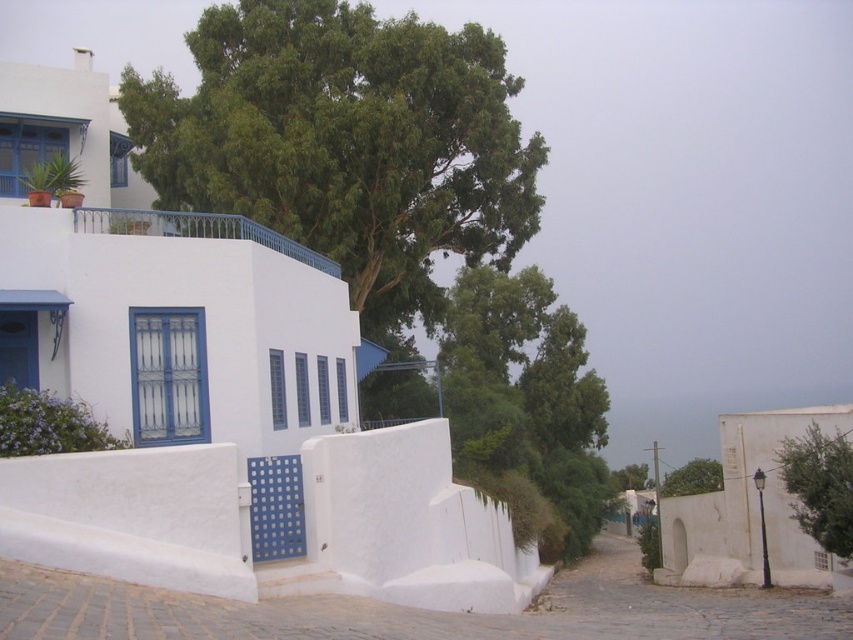
Is green leafy tree at right wider than green leafy tree at center?

No, green leafy tree at right is not wider than green leafy tree at center.

Can you confirm if green leafy tree at right is taller than green leafy tree at center?

Incorrect, green leafy tree at right's height is not larger of green leafy tree at center's.

Is point (844, 490) farther from viewer compared to point (682, 486)?

No.

Locate an element on the screen. Image resolution: width=853 pixels, height=640 pixels. green leafy tree at right is located at coordinates (819, 486).

Is point (387, 228) more distant than point (695, 483)?

No, it is in front of (695, 483).

Between green leafy tree at upper center and green leafy tree at center, which one has less height?

green leafy tree at upper center

Who is more forward, (x=503, y=106) or (x=692, y=461)?

Point (x=503, y=106) is more forward.

This screenshot has height=640, width=853. Find the location of `green leafy tree at upper center`. green leafy tree at upper center is located at coordinates (346, 141).

Who is higher up, green leafy tree at upper center or green leafy tree at right?

green leafy tree at upper center is above.

Measure the distance between point (x=289, y=168) and camera.

Point (x=289, y=168) and camera are 24.43 meters apart from each other.

Where is `green leafy tree at upper center`? green leafy tree at upper center is located at coordinates (346, 141).